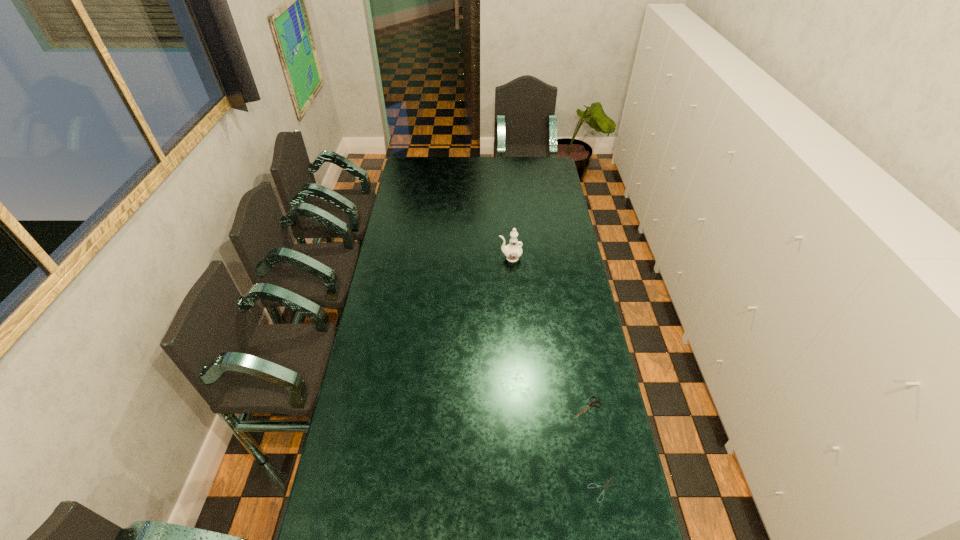
Find the location of `vacant area situated on the left of the nearest object`. vacant area situated on the left of the nearest object is located at coordinates (525, 489).

The image size is (960, 540). In the image, there is a desktop. In order to click on free space at the far edge in this screenshot , I will do `click(471, 162)`.

The width and height of the screenshot is (960, 540). In order to click on free space at the left edge of the desktop in this screenshot , I will do `click(422, 221)`.

In order to click on free space at the far left corner of the desktop in this screenshot , I will do `click(411, 176)`.

Identify the location of unoccupied area between the nearer shears and the tallest object. (557, 374).

Image resolution: width=960 pixels, height=540 pixels. In order to click on unoccupied position between the leftmost object and the second farthest object in this screenshot , I will do `click(548, 333)`.

In order to click on unoccupied position between the second farthest object and the shortest object in this screenshot , I will do `click(595, 448)`.

Locate an element on the screen. The image size is (960, 540). unoccupied position between the taller shears and the nearer shears is located at coordinates (595, 448).

Identify the location of free point between the tallest object and the second nearest object. (548, 333).

Locate an element on the screen. free spot between the second tallest object and the tallest object is located at coordinates (548, 333).